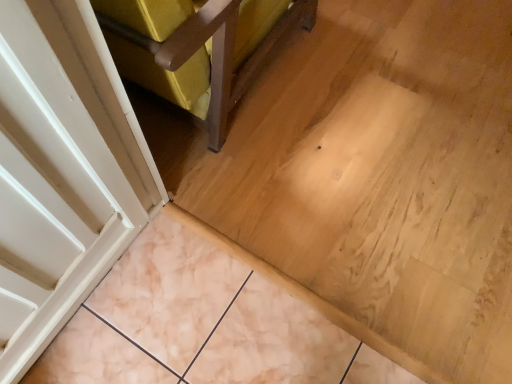
This screenshot has width=512, height=384. What do you see at coordinates (198, 48) in the screenshot?
I see `velvet yellow chair at upper left` at bounding box center [198, 48].

Image resolution: width=512 pixels, height=384 pixels. What are the coordinates of `velvet yellow chair at upper left` in the screenshot? It's located at (198, 48).

Locate an element on the screen. The height and width of the screenshot is (384, 512). velvet yellow chair at upper left is located at coordinates (198, 48).